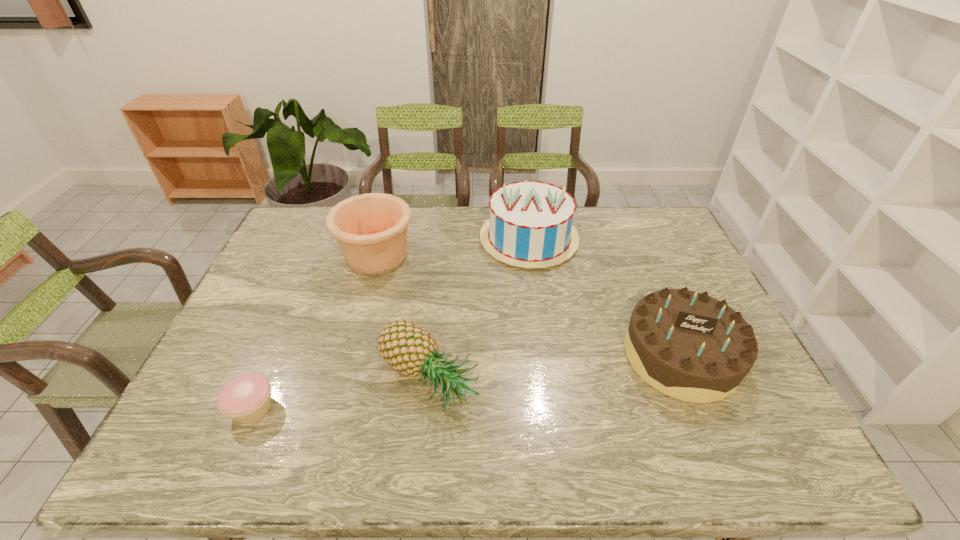
At what (x,y) coordinates should I click in order to perform the action: click on the closest object to the pineapple. Please return your answer as a coordinate pair (x, y). Looking at the image, I should click on (246, 398).

The width and height of the screenshot is (960, 540). In order to click on vacant area in the image that satisfies the following two spatial constraints: 1. on the back side of the farther birthday cake; 2. on the right side of the shortest object in this screenshot , I will do `click(325, 239)`.